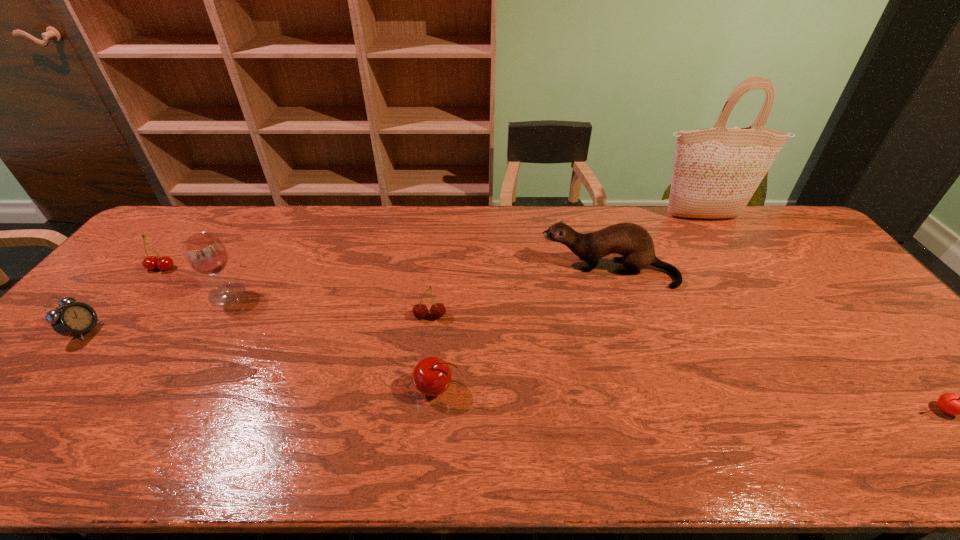
You are a GUI agent. You are given a task and a screenshot of the screen. Output one action in this format:
    pyautogui.click(x=<x>, y=<y>)
    Task: Click on the second object from right to left
    The width and height of the screenshot is (960, 540).
    Given the screenshot: What is the action you would take?
    pyautogui.click(x=716, y=171)

What are the coordinates of `the tallest object` in the screenshot? It's located at (716, 171).

The height and width of the screenshot is (540, 960). I want to click on the sixth object from right to left, so click(x=204, y=252).

Identify the location of the seventh shortest object. The image size is (960, 540). (204, 252).

At what (x,y) coordinates should I click in order to perform the action: click on the sixth object from left to right. Please return your answer as a coordinate pair (x, y). Looking at the image, I should click on (633, 242).

Locate an element on the screen. The width and height of the screenshot is (960, 540). ferret is located at coordinates (633, 242).

Where is `the farthest cherry`? The width and height of the screenshot is (960, 540). the farthest cherry is located at coordinates (164, 263).

I want to click on the second farthest cherry, so click(x=437, y=310).

Image resolution: width=960 pixels, height=540 pixels. I want to click on alarm clock, so click(x=75, y=318).

At what (x,y) coordinates should I click in order to perform the action: click on vacant area situated 0.350m on the front of the farthest object. Please return your answer as a coordinate pair (x, y). The width and height of the screenshot is (960, 540). Looking at the image, I should click on (752, 294).